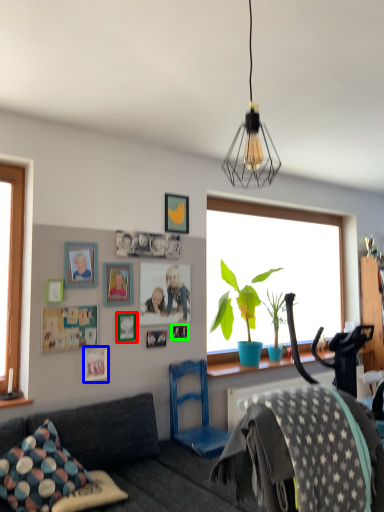
Question: Which object is the farthest from picture frame (highlighted by a red box)? Choose among these: picture frame (highlighted by a blue box) or picture frame (highlighted by a green box).

Choices:
 (A) picture frame
 (B) picture frame

Answer: (B)